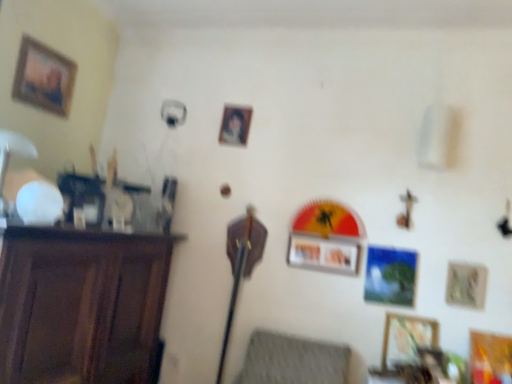
Question: Is matte plastic picture frame at center, the second picture frame viewed from the left, positioned before textured gray cushion at lower center?

Choices:
 (A) yes
 (B) no

Answer: (B)

Question: Is matte plastic picture frame at center, the second picture frame viewed from the left, positioned behind textured gray cushion at lower center?

Choices:
 (A) no
 (B) yes

Answer: (B)

Question: From the image's perspective, is matte plastic picture frame at center, positioned as the 5th picture frame in right-to-left order, on textured gray cushion at lower center?

Choices:
 (A) no
 (B) yes

Answer: (B)

Question: Is matte plastic picture frame at center, positioned as the 5th picture frame in right-to-left order, wider than textured gray cushion at lower center?

Choices:
 (A) no
 (B) yes

Answer: (A)

Question: Is matte plastic picture frame at center, the second picture frame viewed from the left, shorter than textured gray cushion at lower center?

Choices:
 (A) no
 (B) yes

Answer: (B)

Question: From a real-world perspective, is matte plastic picture frame at center, positioned as the 5th picture frame in right-to-left order, on textured gray cushion at lower center?

Choices:
 (A) no
 (B) yes

Answer: (B)

Question: Considering the relative sizes of wooden picture frame at lower right, arranged as the fifth picture frame when viewed from the top, and wooden picture frame at lower right, the 6th picture frame when ordered from top to bottom, in the image provided, is wooden picture frame at lower right, arranged as the fifth picture frame when viewed from the top, wider than wooden picture frame at lower right, the 6th picture frame when ordered from top to bottom,?

Choices:
 (A) no
 (B) yes

Answer: (A)

Question: Could you tell me if wooden picture frame at lower right, placed as the 2th picture frame when sorted from bottom to top, is facing wooden picture frame at lower right, positioned as the sixth picture frame in left-to-right order?

Choices:
 (A) yes
 (B) no

Answer: (B)

Question: Is wooden picture frame at lower right, the fourth picture frame viewed from the left, thinner than wooden picture frame at lower right, which appears as the first picture frame when viewed from the right?

Choices:
 (A) no
 (B) yes

Answer: (B)

Question: Is wooden picture frame at lower right, placed as the 3th picture frame when sorted from right to left, in contact with wooden picture frame at lower right, positioned as the sixth picture frame in left-to-right order?

Choices:
 (A) no
 (B) yes

Answer: (A)

Question: From a real-world perspective, does wooden picture frame at lower right, placed as the 3th picture frame when sorted from right to left, sit lower than wooden picture frame at lower right, the 6th picture frame when ordered from top to bottom?

Choices:
 (A) yes
 (B) no

Answer: (B)

Question: Is wooden picture frame at lower right, placed as the 2th picture frame when sorted from bottom to top, smaller than wooden picture frame at lower right, acting as the first picture frame starting from the bottom?

Choices:
 (A) no
 (B) yes

Answer: (B)

Question: From the image's perspective, does wooden picture frame at center, the third picture frame viewed from the top, appear higher than wooden picture frame at lower right, the fourth picture frame viewed from the left?

Choices:
 (A) yes
 (B) no

Answer: (A)